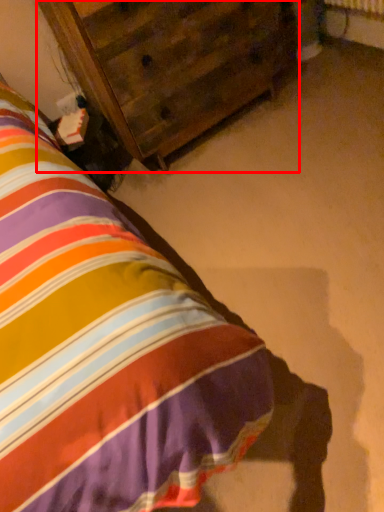
Question: From the image's perspective, where is furniture (annotated by the red box) located relative to nightstand?

Choices:
 (A) below
 (B) above

Answer: (B)